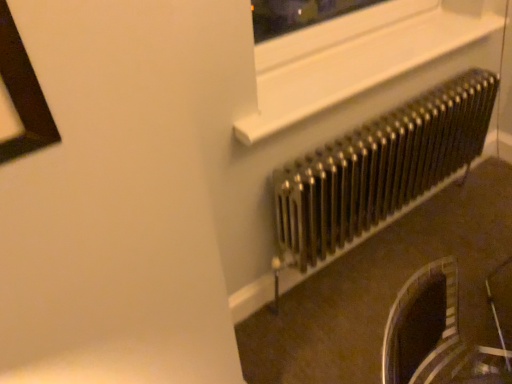
Question: From a real-world perspective, is white plastic window frame at upper center located higher than metallic radiator at right?

Choices:
 (A) yes
 (B) no

Answer: (A)

Question: Would you say white plastic window frame at upper center contains metallic radiator at right?

Choices:
 (A) yes
 (B) no

Answer: (B)

Question: Is white plastic window frame at upper center positioned before metallic radiator at right?

Choices:
 (A) yes
 (B) no

Answer: (A)

Question: Is white plastic window frame at upper center far away from metallic radiator at right?

Choices:
 (A) no
 (B) yes

Answer: (A)

Question: From a real-world perspective, is white plastic window frame at upper center physically below metallic radiator at right?

Choices:
 (A) no
 (B) yes

Answer: (A)

Question: Considering the relative positions of white plastic window frame at upper center and metallic radiator at right in the image provided, is white plastic window frame at upper center to the left of metallic radiator at right from the viewer's perspective?

Choices:
 (A) no
 (B) yes

Answer: (B)

Question: Is metallic radiator at right to the right of white plastic window frame at upper center from the viewer's perspective?

Choices:
 (A) no
 (B) yes

Answer: (B)

Question: From the image's perspective, is metallic radiator at right beneath white plastic window frame at upper center?

Choices:
 (A) no
 (B) yes

Answer: (B)

Question: From a real-world perspective, is metallic radiator at right positioned over white plastic window frame at upper center based on gravity?

Choices:
 (A) yes
 (B) no

Answer: (B)

Question: Considering the relative sizes of metallic radiator at right and white plastic window frame at upper center in the image provided, is metallic radiator at right thinner than white plastic window frame at upper center?

Choices:
 (A) yes
 (B) no

Answer: (A)

Question: Is white plastic window frame at upper center located within metallic radiator at right?

Choices:
 (A) no
 (B) yes

Answer: (A)

Question: Considering the relative sizes of metallic radiator at right and white plastic window frame at upper center in the image provided, is metallic radiator at right bigger than white plastic window frame at upper center?

Choices:
 (A) no
 (B) yes

Answer: (B)

Question: Considering the relative positions of metallic radiator at right and white plastic window frame at upper center in the image provided, is metallic radiator at right to the left or to the right of white plastic window frame at upper center?

Choices:
 (A) left
 (B) right

Answer: (B)